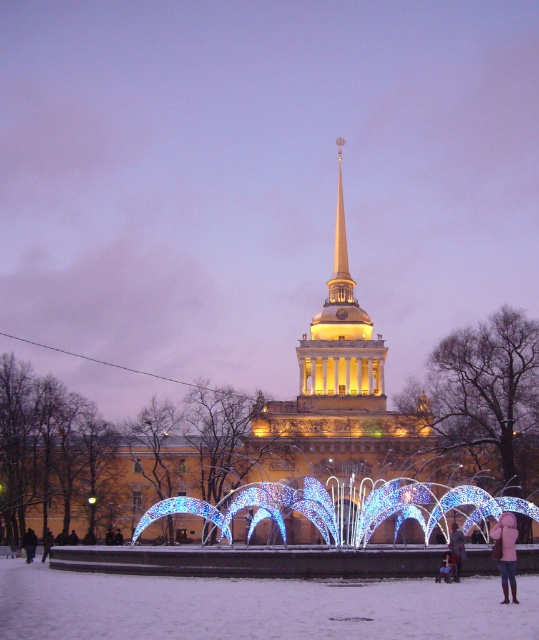
Does gold polished spire at center appear on the left side of light pink woolen coat at lower right?

Indeed, gold polished spire at center is positioned on the left side of light pink woolen coat at lower right.

Does point (328, 284) come in front of point (507, 564)?

No, it is not.

At what (x,y) coordinates should I click in order to perform the action: click on gold polished spire at center. Please return your answer as a coordinate pair (x, y). Looking at the image, I should click on (340, 248).